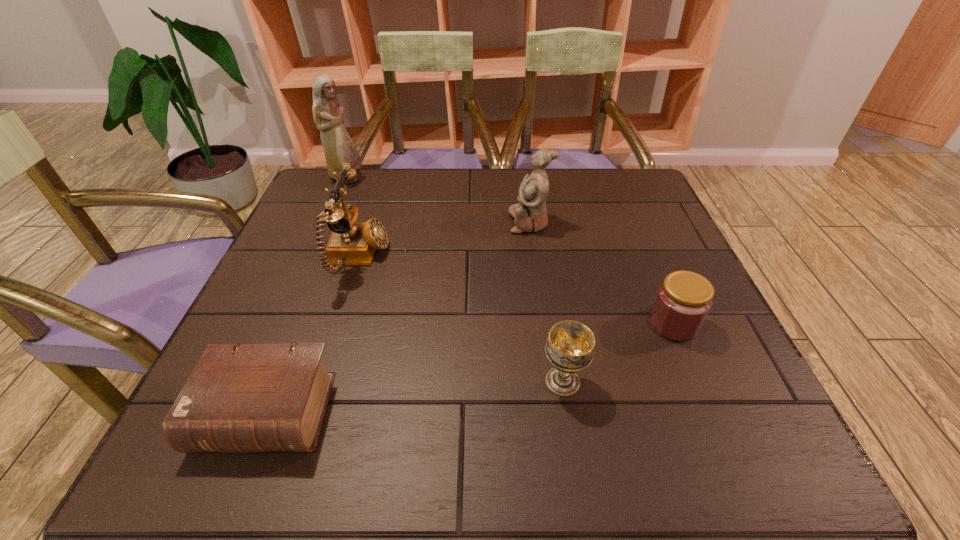
Locate an element on the screen. Image resolution: width=960 pixels, height=540 pixels. free space located on the front-facing side of the shorter figurine is located at coordinates [x=443, y=222].

Image resolution: width=960 pixels, height=540 pixels. I want to click on vacant position located on the front-facing side of the shorter figurine, so click(x=362, y=222).

This screenshot has width=960, height=540. I want to click on vacant space located on the front-facing side of the shorter figurine, so click(x=435, y=222).

You are a GUI agent. You are given a task and a screenshot of the screen. Output one action in this format:
    pyautogui.click(x=<x>, y=<y>)
    Task: Click on the vacant space positioned 0.130m on the dial number of the telephone
    Image resolution: width=960 pixels, height=540 pixels.
    Given the screenshot: What is the action you would take?
    pyautogui.click(x=443, y=258)

This screenshot has width=960, height=540. What are the coordinates of `vacant space located 0.380m on the back of the chalice` in the screenshot? It's located at (540, 237).

You are a GUI agent. You are given a task and a screenshot of the screen. Output one action in this format:
    pyautogui.click(x=<x>, y=<y>)
    Task: Click on the free space located 0.090m on the left of the jam
    The width and height of the screenshot is (960, 540).
    Given the screenshot: What is the action you would take?
    pyautogui.click(x=604, y=323)

You are a GUI agent. You are given a task and a screenshot of the screen. Output one action in this format:
    pyautogui.click(x=<x>, y=<y>)
    Task: Click on the object that is at the near edge
    The height and width of the screenshot is (540, 960).
    Given the screenshot: What is the action you would take?
    [x=240, y=398]

This screenshot has height=540, width=960. What are the coordinates of `figurine at the left edge` in the screenshot? It's located at (339, 148).

Where is `telephone positioned at the left edge`? telephone positioned at the left edge is located at coordinates (352, 242).

This screenshot has height=540, width=960. Find the location of `Bible located in the left edge section of the desktop`. Bible located in the left edge section of the desktop is located at coordinates (240, 398).